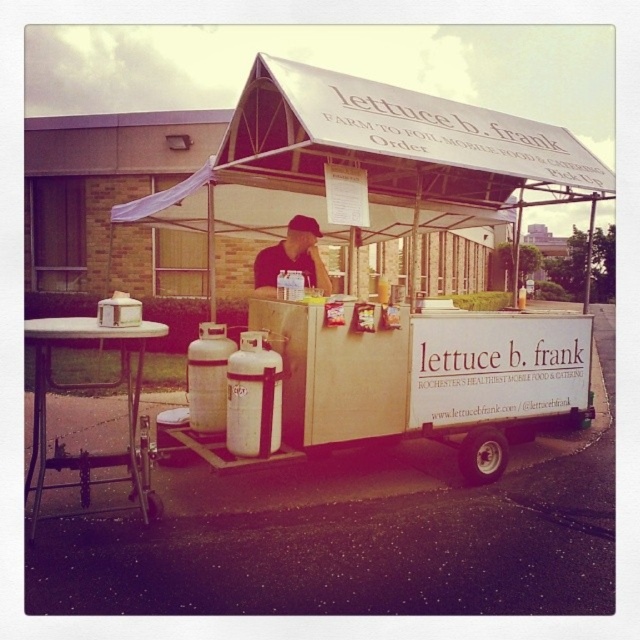
Question: Can you confirm if wooden food cart at center is positioned above matte black shirt at center?

Choices:
 (A) yes
 (B) no

Answer: (A)

Question: Which object appears closest to the camera in this image?

Choices:
 (A) wooden food cart at center
 (B) matte black shirt at center

Answer: (A)

Question: Among these points, which one is nearest to the camera?

Choices:
 (A) (269, 259)
 (B) (284, 74)

Answer: (B)

Question: Does wooden food cart at center have a smaller size compared to matte black shirt at center?

Choices:
 (A) no
 (B) yes

Answer: (A)

Question: Is wooden food cart at center to the right of matte black shirt at center from the viewer's perspective?

Choices:
 (A) no
 (B) yes

Answer: (B)